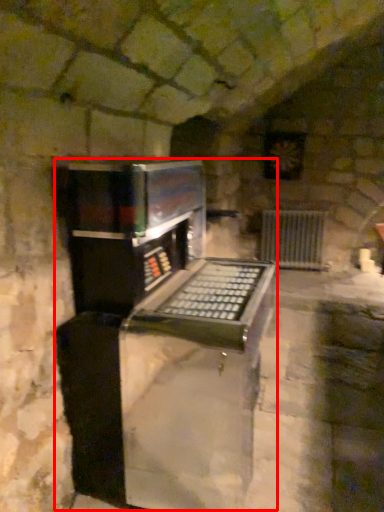
Question: From the image's perspective, where is appliance (annotated by the red box) located relative to radiator?

Choices:
 (A) above
 (B) below

Answer: (B)